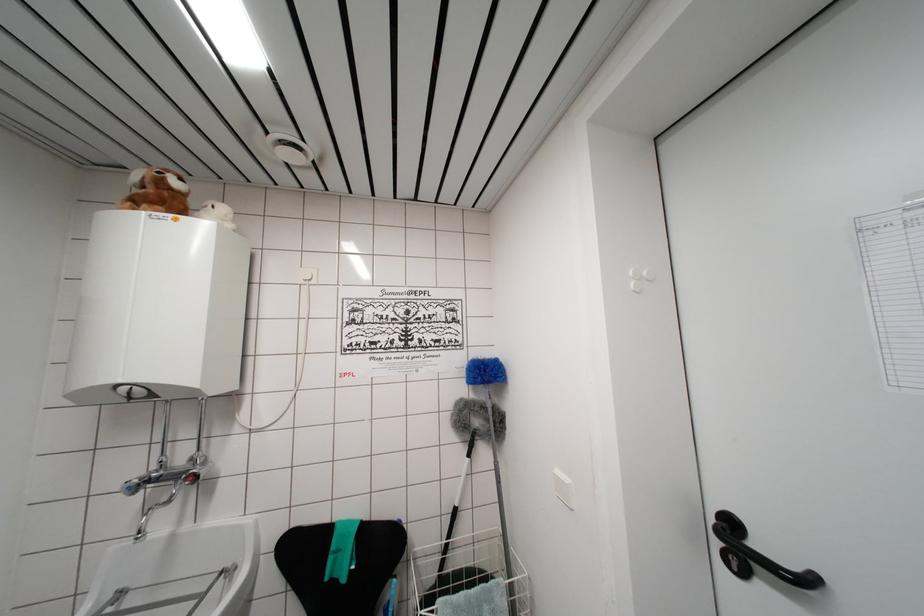
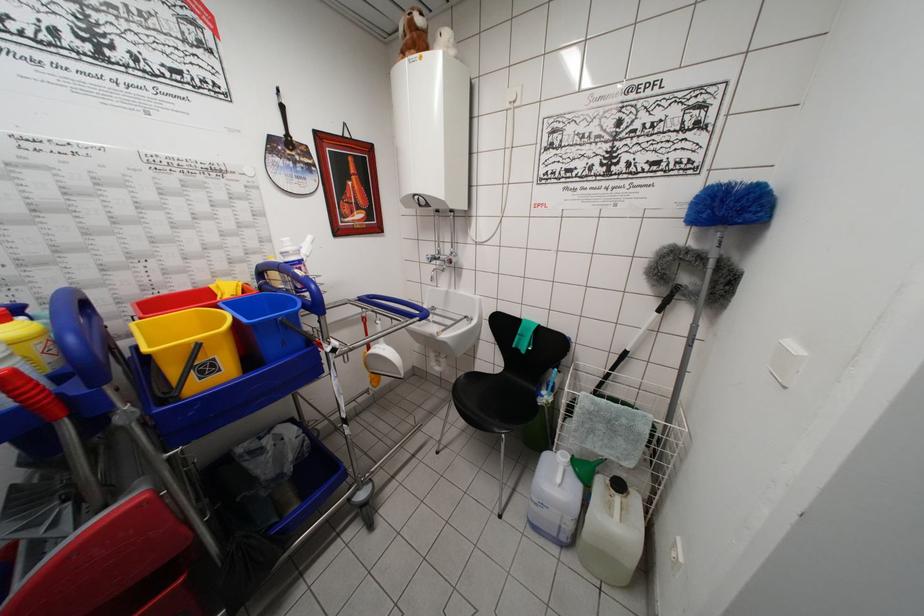
Locate, in the second image, the point that corresponds to point (132, 493) in the first image.

(432, 262)